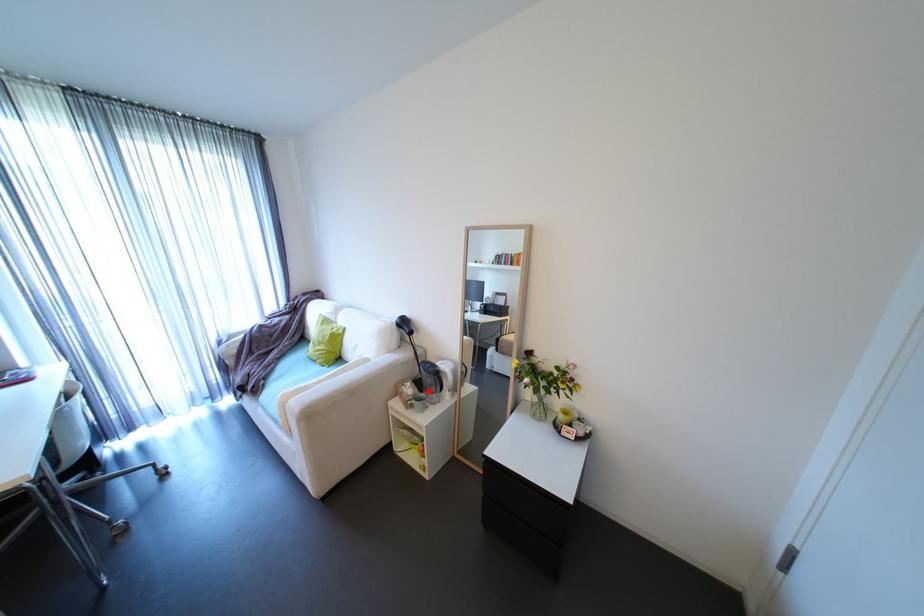
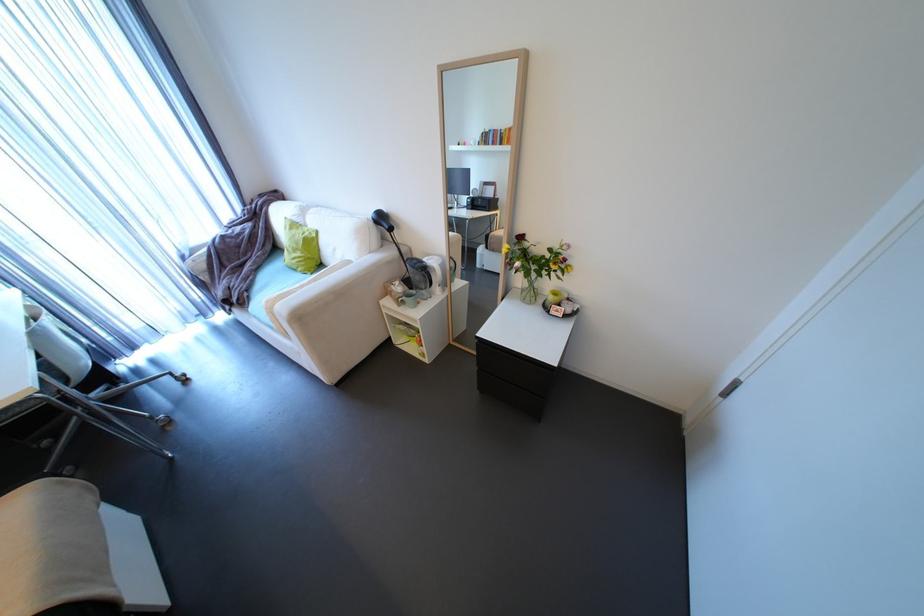
The point at the highlighted location is marked in the first image. Where is the corresponding point in the second image?

(419, 289)